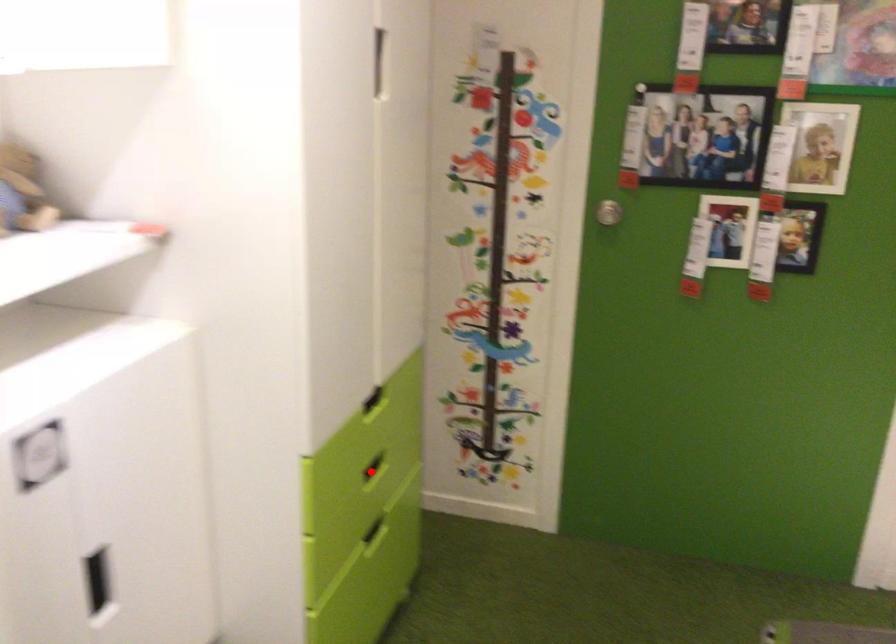
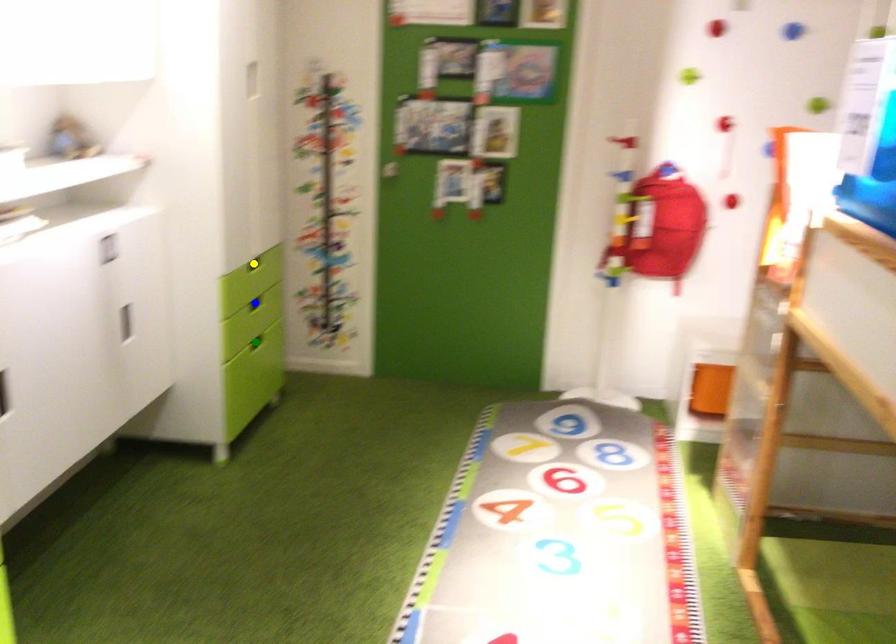
Question: I am providing you with two images of the same scene from different viewpoints. A red point is marked on the first image. You are given multiple points on the second image. Which mark in image 2 goes with the point in image 1?

Choices:
 (A) blue point
 (B) green point
 (C) yellow point

Answer: (A)